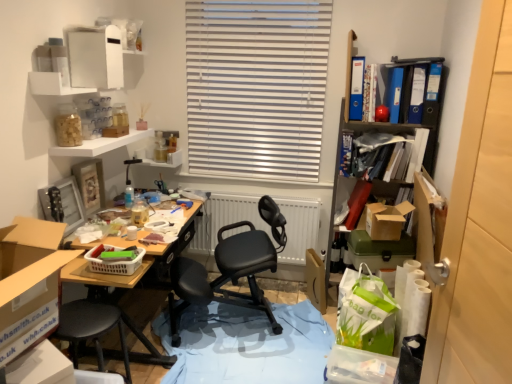
Question: Considering the positions of cardboard box at left, which appears as the second box when viewed from the right, and black leather office chair at center in the image, is cardboard box at left, which appears as the second box when viewed from the right, bigger or smaller than black leather office chair at center?

Choices:
 (A) big
 (B) small

Answer: (B)

Question: From the image's perspective, relative to black leather office chair at center, is cardboard box at left, which appears as the second box when viewed from the right, above or below?

Choices:
 (A) below
 (B) above

Answer: (B)

Question: Which object is positioned closest to the blue glossy file at upper right, which is counted as the fifth book, starting from the left?

Choices:
 (A) brown cardboard box at right, which is the second box in front-to-back order
 (B) plastic basket at center
 (C) matte red book at right, which appears as the 5th book when viewed from the right
 (D) matte blue book at upper right, which is the 4th book in left-to-right order
 (E) cardboard at center

Answer: (D)

Question: Estimate the real-world distances between objects in this image. Which object is closer to the white matte radiator at center?

Choices:
 (A) plastic basket at center
 (B) cardboard box at left, which appears as the second box when viewed from the right
 (C) blue glossy file at upper right, which is the sixth book from left to right
 (D) blue matte book at upper right, placed as the 7th book when sorted from right to left
 (E) matte plastic container at upper center, placed as the third shelf when sorted from front to back

Answer: (E)